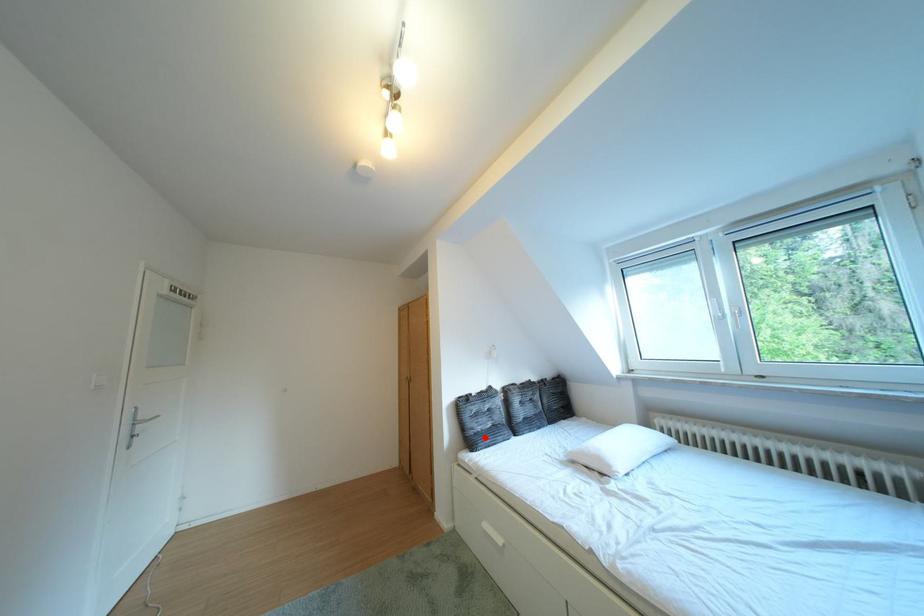
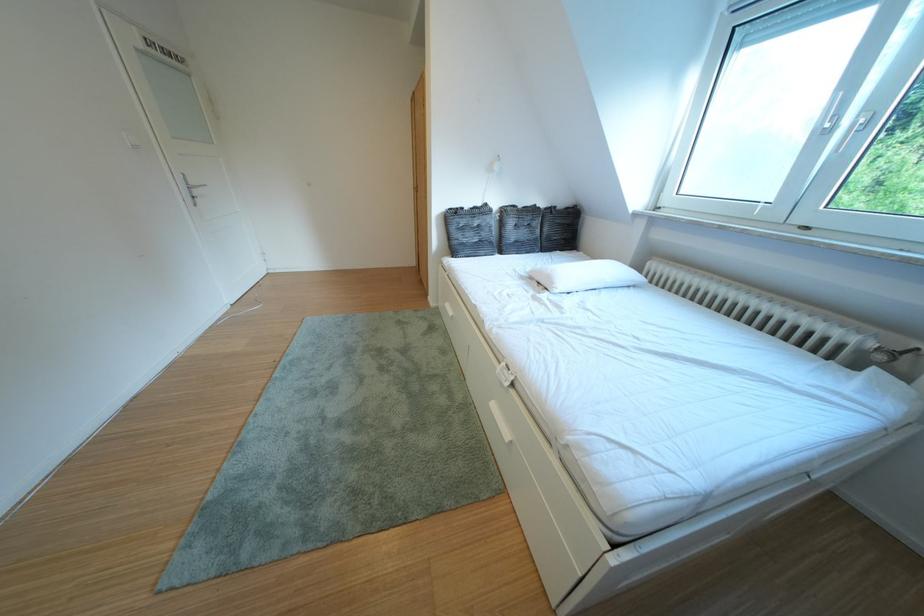
Question: I am providing you with two images of the same scene from different viewpoints. A red point is shown in image1. For the corresponding object point in image2, is it positioned nearer or farther from the camera?

Choices:
 (A) Nearer
 (B) Farther

Answer: (A)